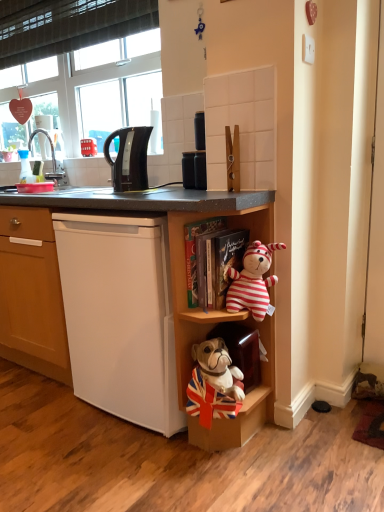
What is the approximate width of velvet-like brown cabinet at lower center, the second cabinet positioned from the left?

The width of velvet-like brown cabinet at lower center, the second cabinet positioned from the left, is 8.51 inches.

This screenshot has width=384, height=512. What are the coordinates of `striped fabric teddy bear at center, placed as the 2th shelf when sorted from bottom to top` in the screenshot? It's located at pyautogui.click(x=184, y=253).

The width and height of the screenshot is (384, 512). What do you see at coordinates (88, 147) in the screenshot?
I see `red plastic phone at upper left` at bounding box center [88, 147].

Locate an element on the screen. Image resolution: width=384 pixels, height=512 pixels. white matte cabinet at lower right, the 2th cabinet in the right-to-left sequence is located at coordinates (168, 216).

How much distance is there between red plastic phone at upper left and transparent plastic bottle at left?

The distance of red plastic phone at upper left from transparent plastic bottle at left is 14.59 inches.

Considering the sizes of objects red plastic phone at upper left and transparent plastic bottle at left in the image provided, who is thinner, red plastic phone at upper left or transparent plastic bottle at left?

transparent plastic bottle at left is thinner.

Based on their sizes in the image, would you say red plastic phone at upper left is bigger or smaller than transparent plastic bottle at left?

red plastic phone at upper left is smaller than transparent plastic bottle at left.

Is red plastic phone at upper left taller or shorter than transparent plastic bottle at left?

Considering their sizes, red plastic phone at upper left has less height than transparent plastic bottle at left.

In the scene shown: From the image's perspective, who appears lower, transparent plastic bottle at left or velvet-like brown cabinet at lower center, which ranks as the 1th cabinet in right-to-left order?

velvet-like brown cabinet at lower center, which ranks as the 1th cabinet in right-to-left order, appears lower in the image.

Is transparent plastic bottle at left not inside velvet-like brown cabinet at lower center, which ranks as the 1th cabinet in right-to-left order?

That's correct, transparent plastic bottle at left is outside of velvet-like brown cabinet at lower center, which ranks as the 1th cabinet in right-to-left order.

Is transparent plastic bottle at left wider than velvet-like brown cabinet at lower center, the second cabinet positioned from the left?

Incorrect, the width of transparent plastic bottle at left does not surpass that of velvet-like brown cabinet at lower center, the second cabinet positioned from the left.

From a real-world perspective, is transparent plastic bottle at left located higher than velvet-like brown cabinet at lower center, the second cabinet positioned from the left?

Yes, from a real-world perspective, transparent plastic bottle at left is on top of velvet-like brown cabinet at lower center, the second cabinet positioned from the left.

What's the angular difference between wooden shelf at lower right, marked as the 2th shelf in a top-to-bottom arrangement, and brushed metal faucet at upper left's facing directions?

The angle between the facing direction of wooden shelf at lower right, marked as the 2th shelf in a top-to-bottom arrangement, and the facing direction of brushed metal faucet at upper left is 2.48 degrees.

Does wooden shelf at lower right, marked as the 2th shelf in a top-to-bottom arrangement, have a lesser height compared to brushed metal faucet at upper left?

Incorrect, the height of wooden shelf at lower right, marked as the 2th shelf in a top-to-bottom arrangement, does not fall short of that of brushed metal faucet at upper left.

Considering the relative sizes of wooden shelf at lower right, marked as the first shelf in a bottom-to-top arrangement, and brushed metal faucet at upper left in the image provided, is wooden shelf at lower right, marked as the first shelf in a bottom-to-top arrangement, wider than brushed metal faucet at upper left?

Correct, the width of wooden shelf at lower right, marked as the first shelf in a bottom-to-top arrangement, exceeds that of brushed metal faucet at upper left.

Is wooden shelf at lower right, marked as the first shelf in a bottom-to-top arrangement, at the right side of brushed metal faucet at upper left?

Yes.

Is striped fabric teddy bear at center, placed as the 2th shelf when sorted from bottom to top, oriented away from matte black canister at upper center?

No, matte black canister at upper center is not at the back of striped fabric teddy bear at center, placed as the 2th shelf when sorted from bottom to top.

Is matte black canister at upper center located within striped fabric teddy bear at center, which appears as the 1th shelf when viewed from the top?

No, matte black canister at upper center is not inside striped fabric teddy bear at center, which appears as the 1th shelf when viewed from the top.

How much distance is there between striped fabric teddy bear at center, which appears as the 1th shelf when viewed from the top, and matte black canister at upper center?

striped fabric teddy bear at center, which appears as the 1th shelf when viewed from the top, and matte black canister at upper center are 35.35 centimeters apart.

Considering the relative sizes of striped fabric teddy bear at center, placed as the 2th shelf when sorted from bottom to top, and matte black canister at upper center in the image provided, is striped fabric teddy bear at center, placed as the 2th shelf when sorted from bottom to top, wider than matte black canister at upper center?

Indeed, striped fabric teddy bear at center, placed as the 2th shelf when sorted from bottom to top, has a greater width compared to matte black canister at upper center.

Considering the relative sizes of matte black canister at upper center and wooden shelf at lower right, marked as the 2th shelf in a top-to-bottom arrangement, in the image provided, is matte black canister at upper center thinner than wooden shelf at lower right, marked as the 2th shelf in a top-to-bottom arrangement,?

Yes, matte black canister at upper center is thinner than wooden shelf at lower right, marked as the 2th shelf in a top-to-bottom arrangement.

Identify the location of appliance behind the wooden shelf at lower right, marked as the first shelf in a bottom-to-top arrangement. This screenshot has height=512, width=384. (194, 170).

Is matte black canister at upper center to the right of wooden shelf at lower right, marked as the first shelf in a bottom-to-top arrangement, from the viewer's perspective?

In fact, matte black canister at upper center is to the left of wooden shelf at lower right, marked as the first shelf in a bottom-to-top arrangement.

Considering the sizes of matte black canister at upper center and wooden shelf at lower right, marked as the first shelf in a bottom-to-top arrangement, in the image, is matte black canister at upper center taller or shorter than wooden shelf at lower right, marked as the first shelf in a bottom-to-top arrangement,?

Considering their sizes, matte black canister at upper center has less height than wooden shelf at lower right, marked as the first shelf in a bottom-to-top arrangement.

In the scene shown: Is white matte refrigerator at lower left further to camera compared to striped fabric teddy bear at center, placed as the 2th shelf when sorted from bottom to top?

That is True.

Choose the correct answer: Is white matte refrigerator at lower left inside striped fabric teddy bear at center, which appears as the 1th shelf when viewed from the top, or outside it?

white matte refrigerator at lower left is spatially situated outside striped fabric teddy bear at center, which appears as the 1th shelf when viewed from the top.

Would you say white matte refrigerator at lower left is a long distance from striped fabric teddy bear at center, placed as the 2th shelf when sorted from bottom to top?

No, white matte refrigerator at lower left is not far away from striped fabric teddy bear at center, placed as the 2th shelf when sorted from bottom to top.

Looking at this image, considering their positions, is black glossy electric kettle at upper left located in front of or behind red plastic phone at upper left?

Visually, black glossy electric kettle at upper left is located in front of red plastic phone at upper left.

Locate an element on the screen. This screenshot has height=512, width=384. coffee maker below the red plastic phone at upper left (from the image's perspective) is located at coordinates (129, 158).

Which of these two, black glossy electric kettle at upper left or red plastic phone at upper left, is wider?

With larger width is black glossy electric kettle at upper left.

Based on the photo, considering the relative sizes of black glossy electric kettle at upper left and red plastic phone at upper left in the image provided, is black glossy electric kettle at upper left smaller than red plastic phone at upper left?

No.

This screenshot has height=512, width=384. What are the coordinates of `corded phone that is above the transparent plastic bottle at left (from the image's perspective)` in the screenshot? It's located at (88, 147).

From the image's perspective, count 2nd cabinets downward from the transparent plastic bottle at left and point to it. Please provide its 2D coordinates.

[(198, 337)]

Estimate the real-world distances between objects in this image. Which object is further from wooden shelf at lower right, marked as the first shelf in a bottom-to-top arrangement, velvet-like brown cabinet at lower center, the second cabinet positioned from the left, or white matte cabinet at lower right, the 2th cabinet in the right-to-left sequence?

white matte cabinet at lower right, the 2th cabinet in the right-to-left sequence, is positioned further to the anchor wooden shelf at lower right, marked as the first shelf in a bottom-to-top arrangement.

Considering their positions, is wooden shelf at lower right, marked as the 2th shelf in a top-to-bottom arrangement, positioned further to transparent plastic bottle at left than red plastic phone at upper left?

wooden shelf at lower right, marked as the 2th shelf in a top-to-bottom arrangement.

When comparing their distances from matte black canister at upper center, does red plastic phone at upper left or striped fabric teddy bear at center, placed as the 2th shelf when sorted from bottom to top, seem further?

Among the two, red plastic phone at upper left is located further to matte black canister at upper center.

Based on their spatial positions, is red plastic phone at upper left or black glossy electric kettle at upper left closer to transparent plastic bottle at left?

red plastic phone at upper left is closer to transparent plastic bottle at left.

Estimate the real-world distances between objects in this image. Which object is closer to transparent plastic bottle at left, black glossy electric kettle at upper left or striped plush toy at upper right?

black glossy electric kettle at upper left is positioned closer to the anchor transparent plastic bottle at left.

When comparing their distances from striped fabric teddy bear at center, which appears as the 1th shelf when viewed from the top, does striped plush toy at upper right or red plastic phone at upper left seem further?

red plastic phone at upper left is positioned further to the anchor striped fabric teddy bear at center, which appears as the 1th shelf when viewed from the top.

When comparing their distances from red plastic phone at upper left, does striped fabric teddy bear at center, placed as the 2th shelf when sorted from bottom to top, or striped plush toy at upper right seem closer?

striped fabric teddy bear at center, placed as the 2th shelf when sorted from bottom to top, is closer to red plastic phone at upper left.

From the image, which object appears to be farther from white matte refrigerator at lower left, transparent plastic bottle at left or wooden shelf at lower right, marked as the first shelf in a bottom-to-top arrangement?

transparent plastic bottle at left is positioned further to the anchor white matte refrigerator at lower left.

At what (x,y) coordinates should I click in order to perform the action: click on cabinet located between transparent plastic bottle at left and striped fabric teddy bear at center, placed as the 2th shelf when sorted from bottom to top, in the left-right direction. Please return your answer as a coordinate pair (x, y). The width and height of the screenshot is (384, 512). Looking at the image, I should click on (168, 216).

The image size is (384, 512). In order to click on shelf between striped plush toy at upper right and velvet-like brown cabinet at lower center, which ranks as the 1th cabinet in right-to-left order, in the vertical direction in this screenshot , I will do `click(213, 326)`.

What are the coordinates of `shelf between black glossy electric kettle at upper left and wooden shelf at lower right, marked as the first shelf in a bottom-to-top arrangement, from top to bottom` in the screenshot? It's located at (184, 253).

Find the location of `faucet between transparent plastic bottle at left and striped plush toy at upper right from left to right`. faucet between transparent plastic bottle at left and striped plush toy at upper right from left to right is located at coordinates click(x=52, y=160).